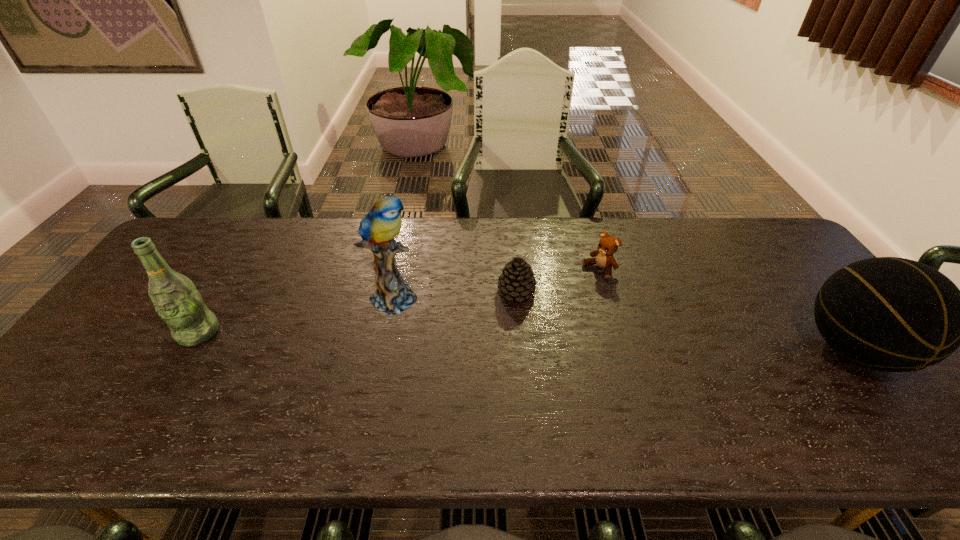
At what (x,y) coordinates should I click in order to perform the action: click on object that is positioned at the near right corner. Please return your answer as a coordinate pair (x, y). The height and width of the screenshot is (540, 960). Looking at the image, I should click on (890, 314).

The height and width of the screenshot is (540, 960). I want to click on free region at the far edge of the desktop, so click(342, 227).

At what (x,y) coordinates should I click in order to perform the action: click on blank space at the near edge of the desktop. Please return your answer as a coordinate pair (x, y). Looking at the image, I should click on (764, 402).

Find the location of a particular element. This screenshot has width=960, height=540. vacant space at the left edge of the desktop is located at coordinates (125, 306).

At what (x,y) coordinates should I click in order to perform the action: click on vacant space at the right edge of the desktop. Please return your answer as a coordinate pair (x, y). Looking at the image, I should click on (778, 281).

This screenshot has width=960, height=540. In order to click on vacant space at the near right corner of the desktop in this screenshot , I will do `click(910, 402)`.

This screenshot has height=540, width=960. In order to click on vacant area that lies between the rightmost object and the tallest object in this screenshot , I will do `click(625, 323)`.

Find the location of a particular element. The image size is (960, 540). vacant area between the beer bottle and the parrot is located at coordinates (297, 314).

At what (x,y) coordinates should I click in order to perform the action: click on vacant space in between the tallest object and the rightmost object. Please return your answer as a coordinate pair (x, y). This screenshot has width=960, height=540. Looking at the image, I should click on (625, 323).

This screenshot has width=960, height=540. Find the location of `free spot between the rightmost object and the leftmost object`. free spot between the rightmost object and the leftmost object is located at coordinates (x=526, y=341).